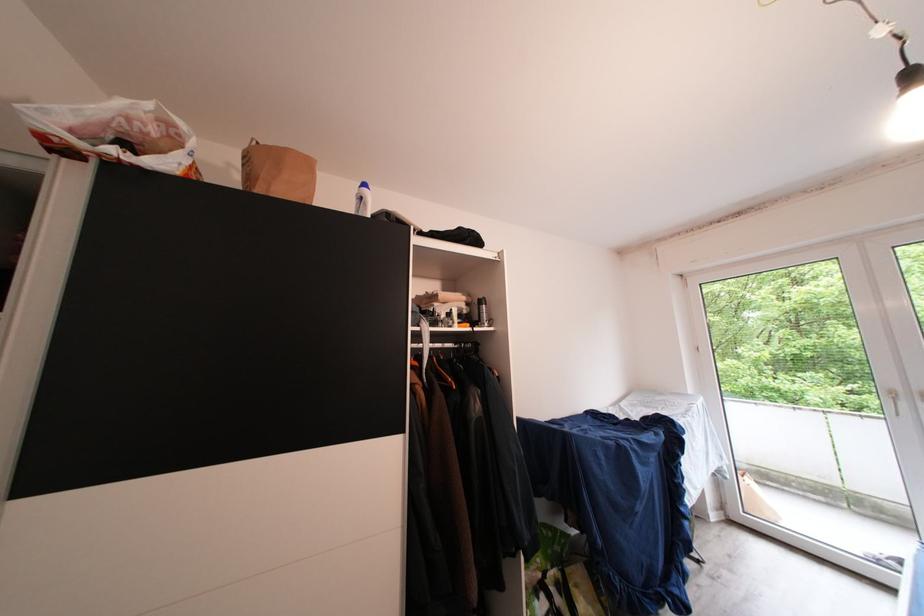
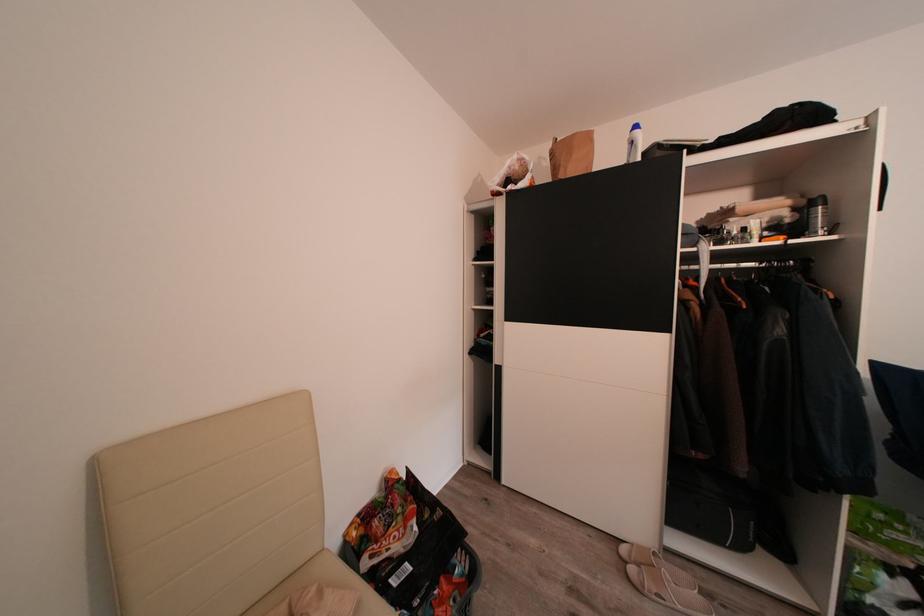
Where in the second image is the point corresponding to pixel 258 183 from the first image?

(564, 174)